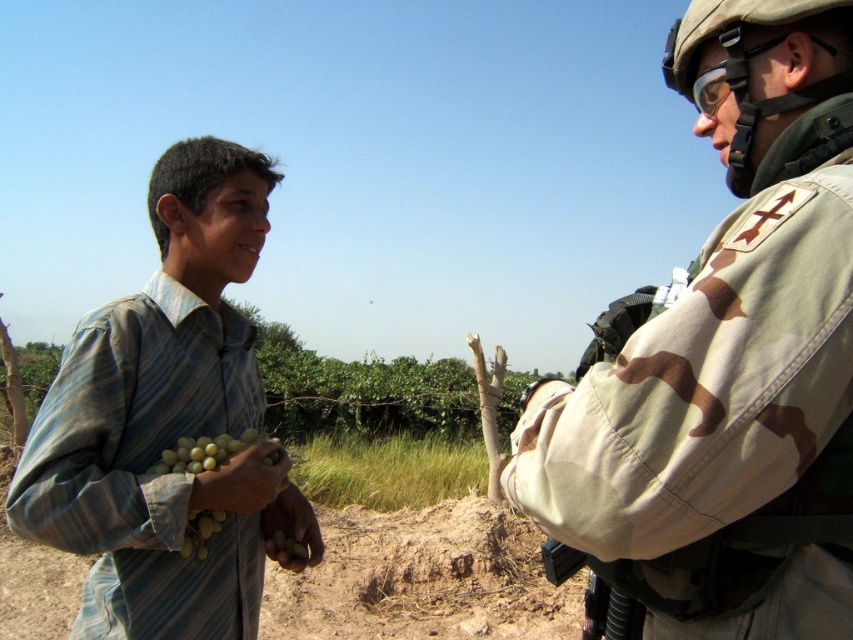
Measure the distance between striped fabric boy at left and green matte grapes at lower left.

striped fabric boy at left is 3.74 inches away from green matte grapes at lower left.

Can you confirm if striped fabric boy at left is positioned to the right of green matte grapes at lower left?

In fact, striped fabric boy at left is to the left of green matte grapes at lower left.

The width and height of the screenshot is (853, 640). What do you see at coordinates (167, 422) in the screenshot?
I see `striped fabric boy at left` at bounding box center [167, 422].

In order to click on striped fabric boy at left in this screenshot , I will do `click(167, 422)`.

Which is more to the right, camouflage fabric uniform at right or green matte grapes at lower left?

camouflage fabric uniform at right is more to the right.

Is camouflage fabric uniform at right to the left of green matte grapes at lower left from the viewer's perspective?

In fact, camouflage fabric uniform at right is to the right of green matte grapes at lower left.

Is point (764, 184) positioned behind point (193, 540)?

No, (764, 184) is in front of (193, 540).

Locate an element on the screen. camouflage fabric uniform at right is located at coordinates (727, 360).

Which is above, striped fabric boy at left or camouflage fabric gun at right?

striped fabric boy at left is above.

Does striped fabric boy at left have a larger size compared to camouflage fabric gun at right?

Yes, striped fabric boy at left is bigger than camouflage fabric gun at right.

What do you see at coordinates (167, 422) in the screenshot? Image resolution: width=853 pixels, height=640 pixels. I see `striped fabric boy at left` at bounding box center [167, 422].

Where is `striped fabric boy at left`? striped fabric boy at left is located at coordinates (167, 422).